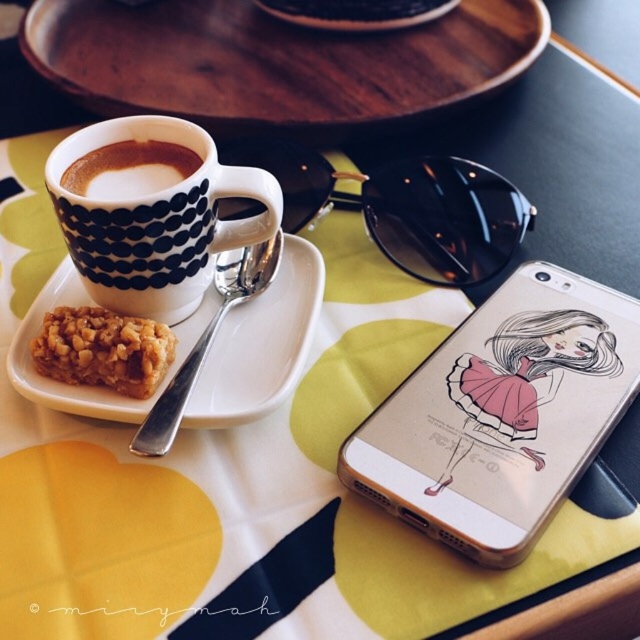
You are taking a photo of the scene from the camera position. Which point, point (625, 380) or point (38, 52), will appear larger in the photo?

Point (625, 380) is closer to the camera than point (38, 52), so it will appear larger in the photo.

You are a barista trying to place both the white matte saucer at upper left and the crispy golden bar at upper left on a shelf that can only hold items up to 12 cm in width. Can you fit both items on the shelf if the saucer is wider than the bar?

The white matte saucer at upper left might be wider than the crispy golden bar at upper left, but without knowing their exact widths, it is uncertain if both will fit on the 12 cm shelf. Measure both items to confirm.